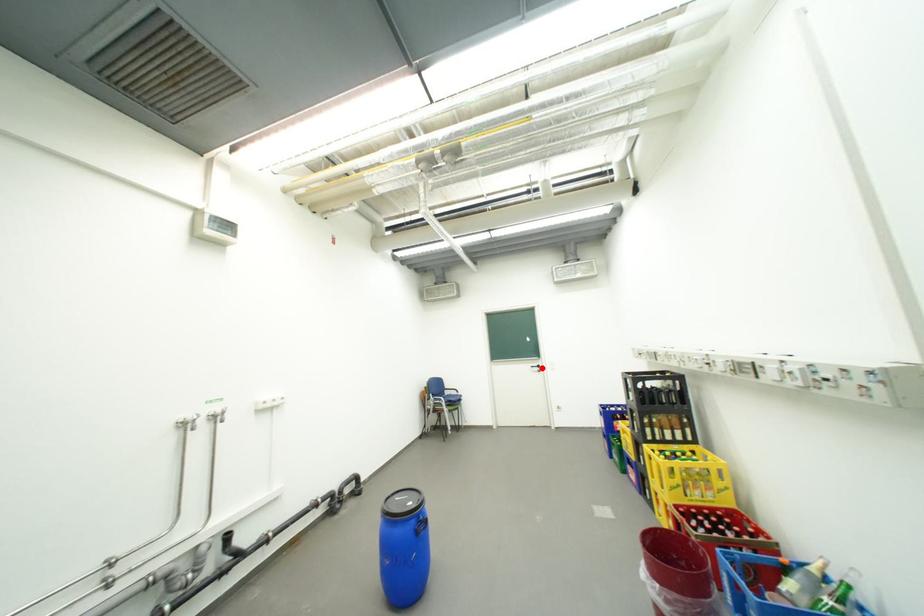
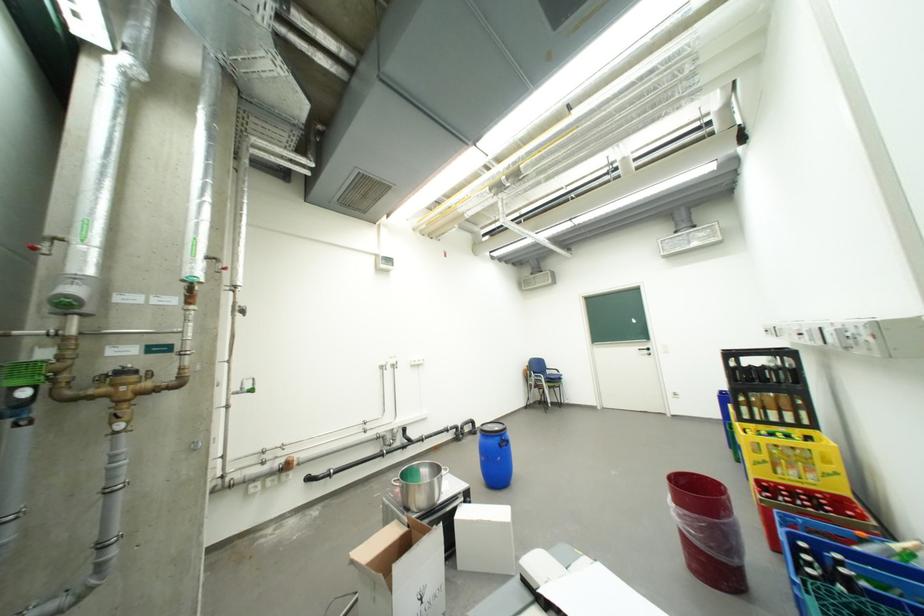
Question: I am providing you with two images of the same scene from different viewpoints. A red point is marked on the first image. Can you still see the location of the red point in image 2?

Choices:
 (A) Yes
 (B) No

Answer: (A)